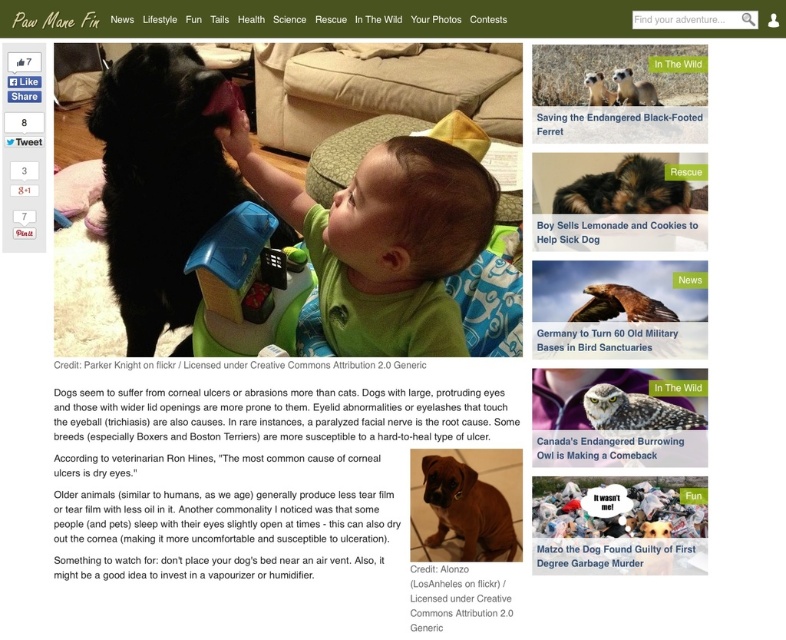
You are a veterinarian examining the webpage. You notice the brown furry dog at center and the furry black ferret at upper center. Based on their positions, which animal is closer to the viewer?

The brown furry dog at center is closer to the viewer because the furry black ferret at upper center is behind it.

You are a delivery robot that needs to place a small package between the matte brown owl at upper right and the furry black ferret at upper center. The package is 12 inches long. Can it fit in the space between them?

The distance between the matte brown owl at upper right and the furry black ferret at upper center is 14.01 inches, so the 12 inch package can fit in the space between them.